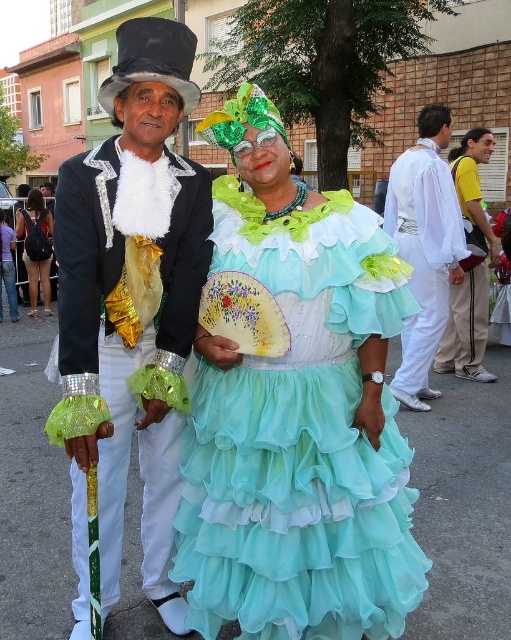
Question: Which point is farther to the camera?

Choices:
 (A) (34, 248)
 (B) (356, 301)
 (C) (472, 262)

Answer: (A)

Question: Can you confirm if white sheer fabric at right is bigger than yellow t-shirt at center?

Choices:
 (A) no
 (B) yes

Answer: (A)

Question: Is turquoise chiffon dress at center to the right of matte black backpack at left from the viewer's perspective?

Choices:
 (A) no
 (B) yes

Answer: (B)

Question: Which of these objects is positioned farthest from the turquoise chiffon dress at center?

Choices:
 (A) white sheer fabric at right
 (B) shiny black fabric top hat at upper left

Answer: (A)

Question: Among these points, which one is farthest from the camera?

Choices:
 (A) (233, 545)
 (B) (49, 243)
 (C) (160, 177)

Answer: (B)

Question: Is yellow t-shirt at center smaller than matte black backpack at left?

Choices:
 (A) no
 (B) yes

Answer: (A)